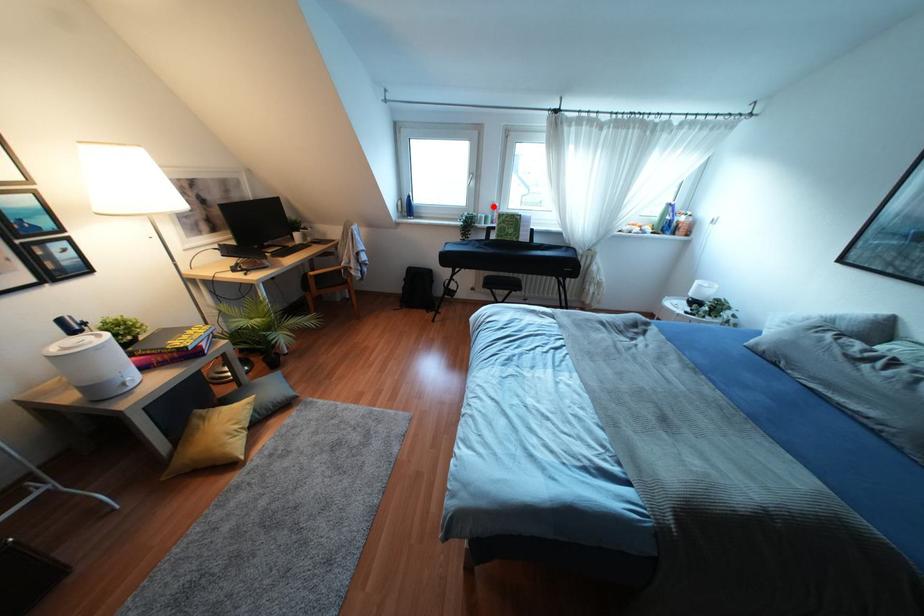
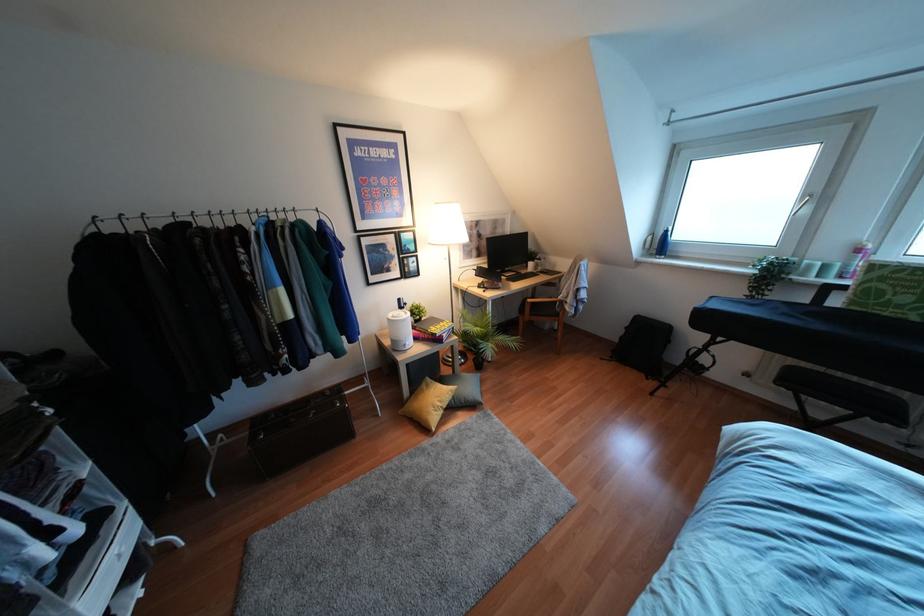
Question: I am providing you with two images of the same scene from different viewpoints. Image1 has a red point marked. In image2, the corresponding 3D location appears at what relative position? Reply with the corresponding letter.

Choices:
 (A) Closer
 (B) Farther

Answer: (B)